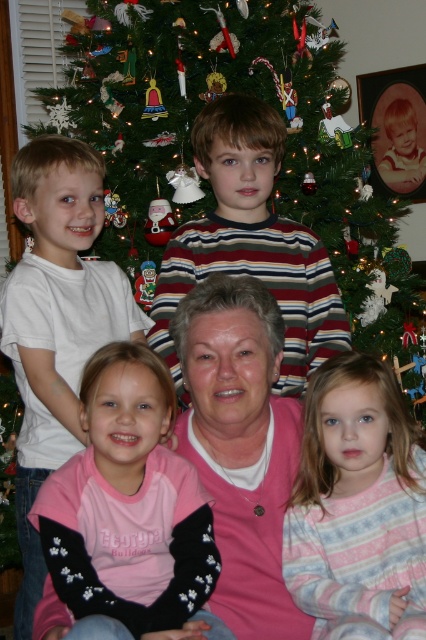
Question: Based on their relative distances, which object is farther from the striped cotton shirt at center?

Choices:
 (A) green textured christmas tree at center
 (B) white t-shirt at left

Answer: (A)

Question: Does green textured christmas tree at center appear under striped cotton shirt at center?

Choices:
 (A) yes
 (B) no

Answer: (B)

Question: Among these points, which one is farthest from the camera?

Choices:
 (A) (193, 509)
 (B) (285, 333)
 (C) (305, 561)
 (D) (207, 355)

Answer: (B)

Question: Which of the following is the closest to the observer?

Choices:
 (A) (307, 468)
 (B) (48, 561)

Answer: (B)

Question: Is pink fleece sweater at lower left to the right of striped cotton shirt at center from the viewer's perspective?

Choices:
 (A) yes
 (B) no

Answer: (B)

Question: Can you confirm if pink striped pajamas at lower right is thinner than white t-shirt at left?

Choices:
 (A) yes
 (B) no

Answer: (A)